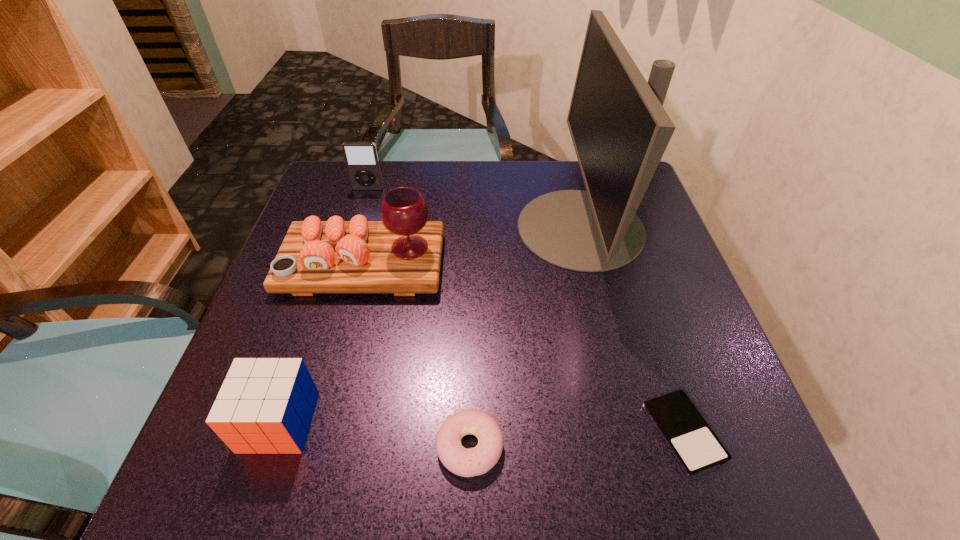
At what (x,y) coordinates should I click in order to perform the action: click on computer monitor. Please return your answer as a coordinate pair (x, y). The width and height of the screenshot is (960, 540). Looking at the image, I should click on (620, 130).

Where is `the second tallest object`? The image size is (960, 540). the second tallest object is located at coordinates (401, 254).

What are the coordinates of `the left iPod` in the screenshot? It's located at (361, 158).

Locate an element on the screen. The height and width of the screenshot is (540, 960). the third tallest object is located at coordinates (361, 158).

Find the location of a particular element. The width and height of the screenshot is (960, 540). cube is located at coordinates (265, 405).

Identify the location of the second shortest object. (464, 462).

This screenshot has height=540, width=960. Find the location of `the fourth object from left to right`. the fourth object from left to right is located at coordinates (464, 462).

This screenshot has height=540, width=960. Find the location of `the shorter iPod`. the shorter iPod is located at coordinates (696, 447).

In order to click on the right iPod in this screenshot , I will do `click(696, 447)`.

This screenshot has width=960, height=540. Identify the location of free space located on the screen of the tallest object. (492, 228).